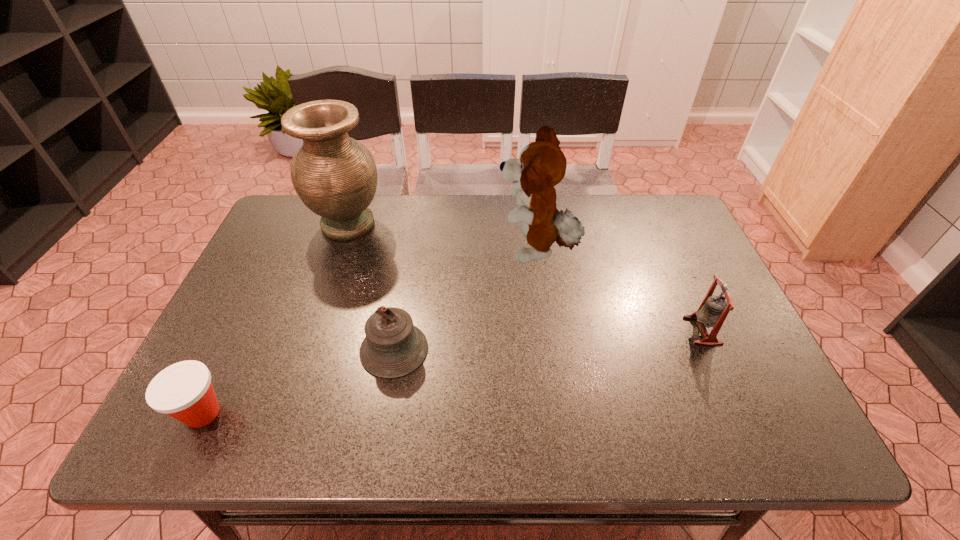
At what (x,y) coordinates should I click in order to perform the action: click on object located in the near left corner section of the desktop. Please return your answer as a coordinate pair (x, y). The image size is (960, 540). Looking at the image, I should click on (184, 391).

Find the location of a particular element. The width and height of the screenshot is (960, 540). vacant position at the far edge of the desktop is located at coordinates (589, 200).

In the image, there is a desktop. Identify the location of vacant space at the near edge. Image resolution: width=960 pixels, height=540 pixels. (245, 445).

In the image, there is a desktop. Where is `vacant area at the left edge`? The width and height of the screenshot is (960, 540). vacant area at the left edge is located at coordinates (243, 358).

In the image, there is a desktop. Where is `vacant space at the far right corner`? vacant space at the far right corner is located at coordinates (686, 221).

In the image, there is a desktop. Identify the location of vacant space at the near right corner. (749, 449).

In order to click on blank region between the shortest object and the vase in this screenshot , I will do `click(276, 319)`.

Locate an element on the screen. vacant space in between the third object from right to left and the Dixie cup is located at coordinates (299, 381).

The image size is (960, 540). In order to click on vacant area between the third object from right to left and the shortest object in this screenshot , I will do `click(299, 381)`.

Identify the location of empty space between the puppy and the third object from left to right. This screenshot has height=540, width=960. (466, 301).